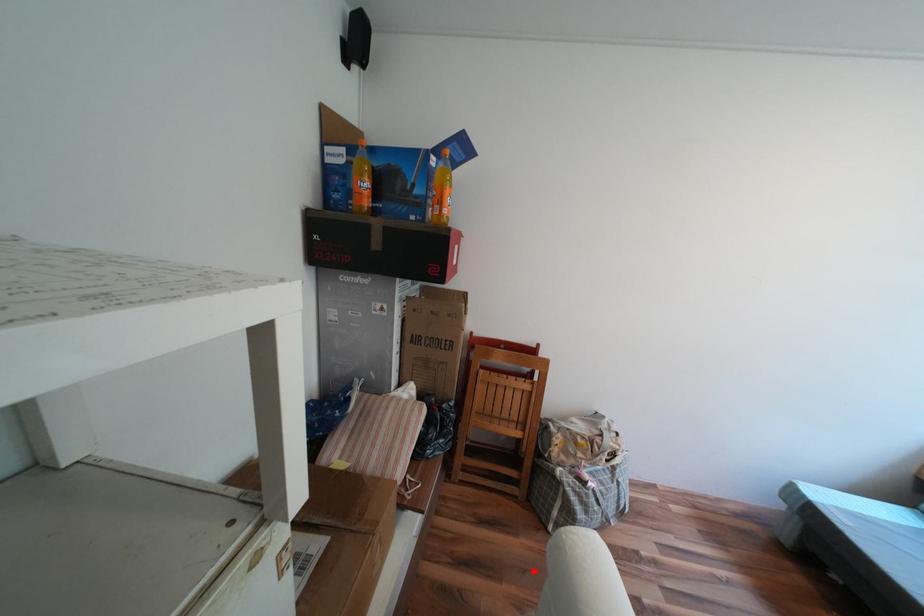
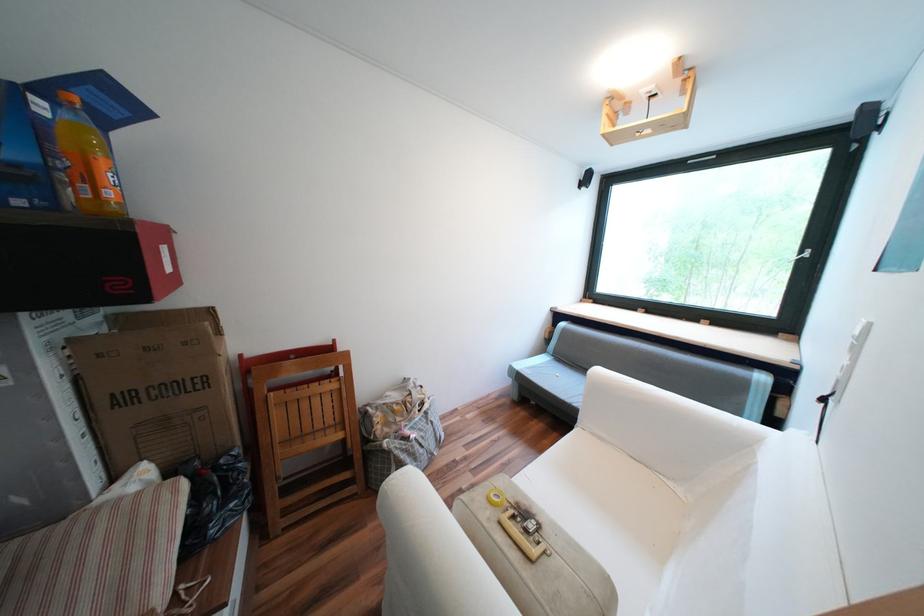
Question: I am providing you with two images of the same scene from different viewpoints. A red point is shown in image1. For the corresponding object point in image2, is it positioned nearer or farther from the camera?

Choices:
 (A) Nearer
 (B) Farther

Answer: (B)